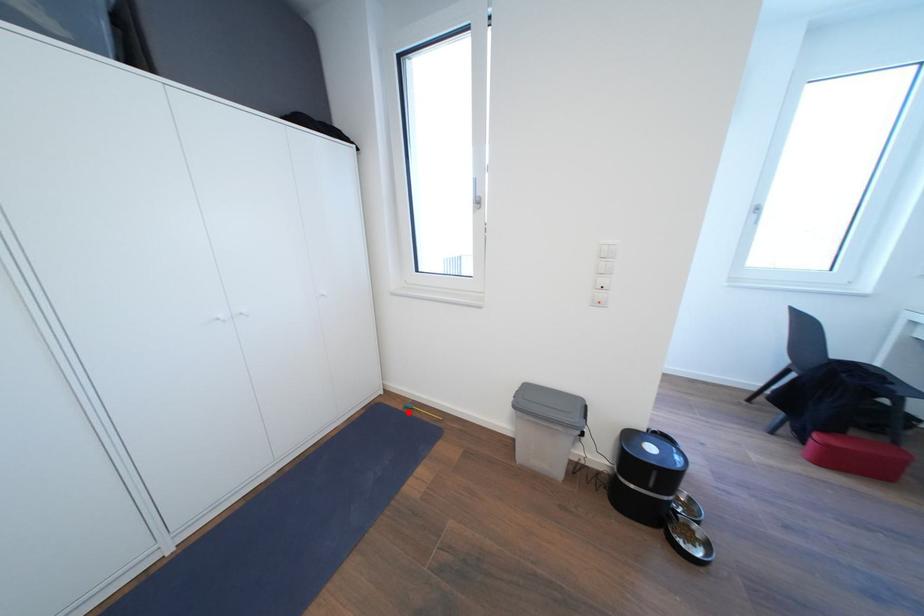
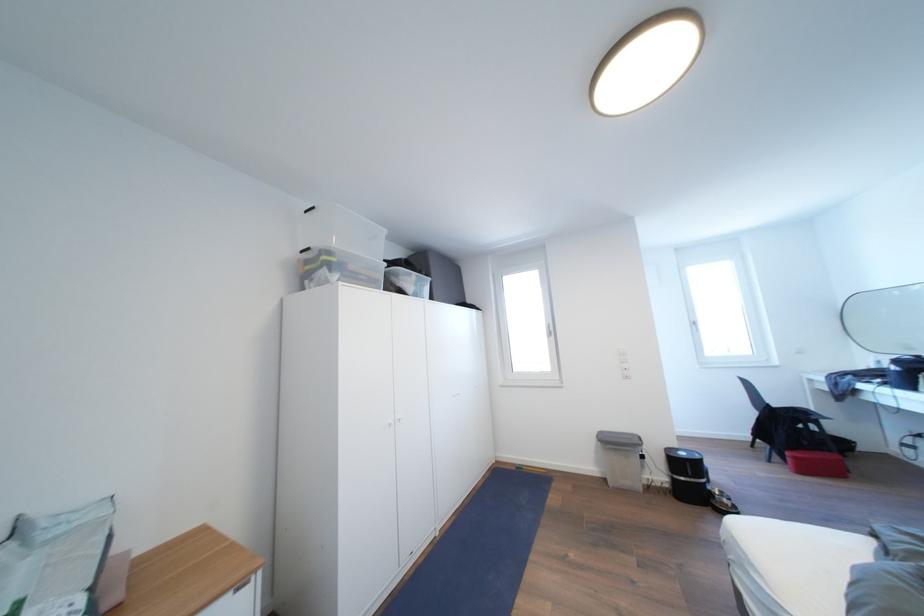
Question: I am providing you with two images of the same scene from different viewpoints. A red point is marked on the first image. Is the red point's position out of view in image 2?

Choices:
 (A) Yes
 (B) No

Answer: (B)